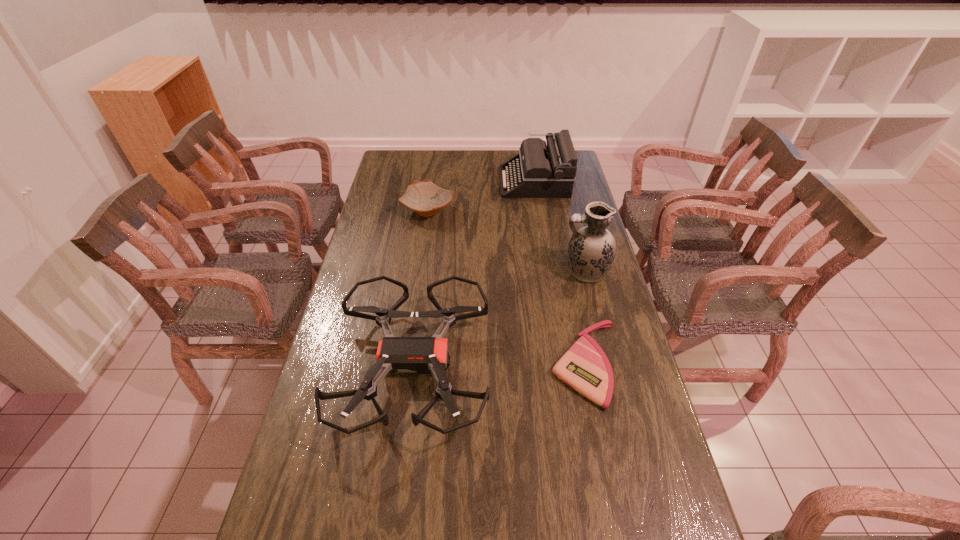
You are a GUI agent. You are given a task and a screenshot of the screen. Output one action in this format:
    pyautogui.click(x=<x>, y=<y>)
    Task: Click on the vacant area between the third shortest object and the third farthest object
    The image size is (960, 540).
    Given the screenshot: What is the action you would take?
    pyautogui.click(x=499, y=319)

The height and width of the screenshot is (540, 960). Identify the location of free space between the shortest object and the third farthest object. (586, 318).

Where is `vacant area that lies between the second tallest object and the second shortest object`? The width and height of the screenshot is (960, 540). vacant area that lies between the second tallest object and the second shortest object is located at coordinates (481, 196).

Identify the location of free spot between the pottery and the shortest object. The image size is (960, 540). (507, 287).

What are the coordinates of `vacant space that is in between the second tallest object and the tallest object` in the screenshot? It's located at (560, 226).

Locate an element on the screen. Image resolution: width=960 pixels, height=540 pixels. empty space between the typewriter and the third shortest object is located at coordinates (473, 274).

Point out which object is positioned as the fourth nearest to the drone. Please provide its 2D coordinates. Your answer should be formatted as a tuple, i.e. [(x, y)], where the tuple contains the x and y coordinates of a point satisfying the conditions above.

[(539, 171)]

Where is `object that stands as the third closest to the second shortest object`? The height and width of the screenshot is (540, 960). object that stands as the third closest to the second shortest object is located at coordinates (592, 249).

Where is `vacant area that satisfies the following two spatial constraints: 1. on the front side of the pottery; 2. on the right side of the shortest object`? The height and width of the screenshot is (540, 960). vacant area that satisfies the following two spatial constraints: 1. on the front side of the pottery; 2. on the right side of the shortest object is located at coordinates (406, 364).

I want to click on vacant point that satisfies the following two spatial constraints: 1. with the handle on the side of the third farthest object; 2. on the typing side of the typewriter, so click(563, 181).